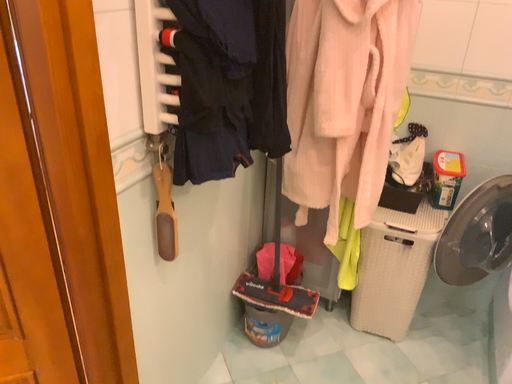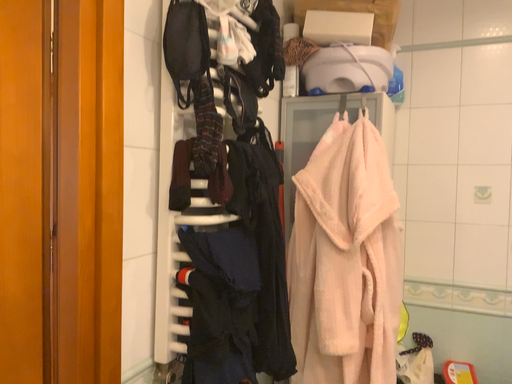
Question: Which way did the camera rotate in the video?

Choices:
 (A) rotated upward
 (B) rotated downward

Answer: (A)